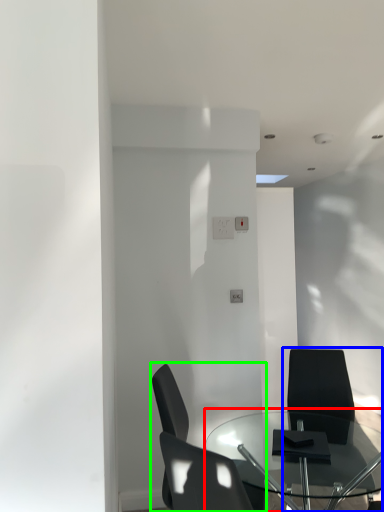
Question: Estimate the real-world distances between objects in this image. Which object is closer to table (highlighted by a red box), chair (highlighted by a blue box) or chair (highlighted by a green box)?

Choices:
 (A) chair
 (B) chair

Answer: (A)